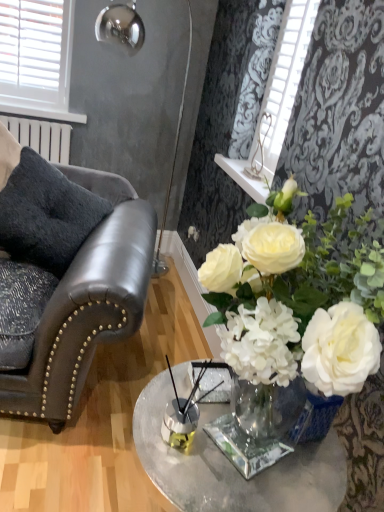
The height and width of the screenshot is (512, 384). What do you see at coordinates (232, 465) in the screenshot?
I see `clear glass table at center` at bounding box center [232, 465].

The height and width of the screenshot is (512, 384). In order to click on metallic silver lamp at upper left in this screenshot , I will do `click(121, 27)`.

This screenshot has height=512, width=384. Find the location of `white plastic blinds at upper left`. white plastic blinds at upper left is located at coordinates (37, 58).

Is point (137, 244) farther from camera compared to point (34, 247)?

No.

From a real-world perspective, which object rests below the other?

black leather chair at left is physically lower.

Considering the relative sizes of black leather chair at left and dark gray plush pillow at left in the image provided, is black leather chair at left taller than dark gray plush pillow at left?

Correct, black leather chair at left is much taller as dark gray plush pillow at left.

Is black leather chair at left facing towards dark gray plush pillow at left?

No, black leather chair at left is not aimed at dark gray plush pillow at left.

Would you say dark gray plush pillow at left is to the left or to the right of metallic silver lamp at upper left in the picture?

From the image, it's evident that dark gray plush pillow at left is to the left of metallic silver lamp at upper left.

From the image's perspective, is dark gray plush pillow at left positioned above or below metallic silver lamp at upper left?

dark gray plush pillow at left is below metallic silver lamp at upper left.

Are dark gray plush pillow at left and metallic silver lamp at upper left far apart?

Yes, dark gray plush pillow at left is far from metallic silver lamp at upper left.

From a real-world perspective, is clear glass table at center on black leather chair at left?

Incorrect, from a real-world perspective, clear glass table at center is lower than black leather chair at left.

Find the location of a particular element. chair behind the clear glass table at center is located at coordinates (74, 304).

From the image's perspective, is clear glass table at center located above or below black leather chair at left?

Clearly, from the image's perspective, clear glass table at center is below black leather chair at left.

Can you tell me how much clear glass table at center and black leather chair at left differ in facing direction?

The facing directions of clear glass table at center and black leather chair at left are 77.4 degrees apart.

From the image's perspective, is black leather chair at left above or below white plastic blinds at upper left?

From the image's perspective, black leather chair at left appears below white plastic blinds at upper left.

From a real-world perspective, between black leather chair at left and white plastic blinds at upper left, who is vertically lower?

black leather chair at left.

Considering the relative sizes of black leather chair at left and white plastic blinds at upper left in the image provided, is black leather chair at left wider than white plastic blinds at upper left?

Yes.

Considering the sizes of objects clear glass table at center and white plastic blinds at upper left in the image provided, who is thinner, clear glass table at center or white plastic blinds at upper left?

white plastic blinds at upper left is thinner.

Does clear glass table at center have a lesser height compared to white plastic blinds at upper left?

In fact, clear glass table at center may be taller than white plastic blinds at upper left.

Measure the distance between clear glass table at center and white plastic blinds at upper left.

clear glass table at center and white plastic blinds at upper left are 7.24 feet apart from each other.

From a real-world perspective, which is physically above, metallic silver lamp at upper left or black leather chair at left?

metallic silver lamp at upper left, from a real-world perspective.

Which object is wider, metallic silver lamp at upper left or black leather chair at left?

Wider between the two is black leather chair at left.

Considering the positions of point (98, 26) and point (135, 228), is point (98, 26) closer or farther from the camera than point (135, 228)?

Point (98, 26) is positioned farther from the camera compared to point (135, 228).

Is metallic silver lamp at upper left directly adjacent to black leather chair at left?

No, metallic silver lamp at upper left is not with black leather chair at left.

Considering the positions of point (39, 9) and point (203, 437), is point (39, 9) closer or farther from the camera than point (203, 437)?

Point (39, 9) is positioned farther from the camera compared to point (203, 437).

From the image's perspective, is white plastic blinds at upper left over clear glass table at center?

Indeed, from the image's perspective, white plastic blinds at upper left is shown above clear glass table at center.

Considering the relative positions of white plastic blinds at upper left and clear glass table at center in the image provided, is white plastic blinds at upper left to the right of clear glass table at center from the viewer's perspective?

No.

Is white plastic blinds at upper left inside or outside of clear glass table at center?

white plastic blinds at upper left is located beyond the bounds of clear glass table at center.

Find the location of a particular element. This screenshot has width=384, height=512. chair on the right of the dark gray plush pillow at left is located at coordinates (x=74, y=304).

The image size is (384, 512). Identify the location of lamp behind the dark gray plush pillow at left. (121, 27).

Which object lies further to the anchor point clear glass table at center, dark gray plush pillow at left or white plastic blinds at upper left?

white plastic blinds at upper left.

Estimate the real-world distances between objects in this image. Which object is further from clear glass table at center, dark gray plush pillow at left or metallic silver lamp at upper left?

Among the two, metallic silver lamp at upper left is located further to clear glass table at center.

When comparing their distances from dark gray plush pillow at left, does clear glass table at center or white plastic blinds at upper left seem closer?

Based on the image, clear glass table at center appears to be nearer to dark gray plush pillow at left.

Consider the image. Looking at the image, which one is located closer to clear glass table at center, white plastic blinds at upper left or metallic silver lamp at upper left?

white plastic blinds at upper left lies closer to clear glass table at center than the other object.

Based on their spatial positions, is clear glass table at center or white plastic blinds at upper left closer to metallic silver lamp at upper left?

white plastic blinds at upper left is positioned closer to the anchor metallic silver lamp at upper left.

From the image, which object appears to be nearer to black leather chair at left, dark gray plush pillow at left or clear glass table at center?

The object closer to black leather chair at left is dark gray plush pillow at left.

When comparing their distances from dark gray plush pillow at left, does white plastic blinds at upper left or black leather chair at left seem further?

The object further to dark gray plush pillow at left is white plastic blinds at upper left.

From the image, which object appears to be farther from clear glass table at center, black leather chair at left or dark gray plush pillow at left?

dark gray plush pillow at left is further to clear glass table at center.

Find the location of `chair that lies between metallic silver lamp at upper left and clear glass table at center from top to bottom`. chair that lies between metallic silver lamp at upper left and clear glass table at center from top to bottom is located at coordinates (74, 304).

I want to click on pillow between metallic silver lamp at upper left and clear glass table at center in the vertical direction, so click(46, 214).

Where is `pillow that lies between white plastic blinds at upper left and clear glass table at center from top to bottom`? The height and width of the screenshot is (512, 384). pillow that lies between white plastic blinds at upper left and clear glass table at center from top to bottom is located at coordinates (46, 214).

The height and width of the screenshot is (512, 384). Identify the location of lamp between white plastic blinds at upper left and black leather chair at left from top to bottom. (121, 27).